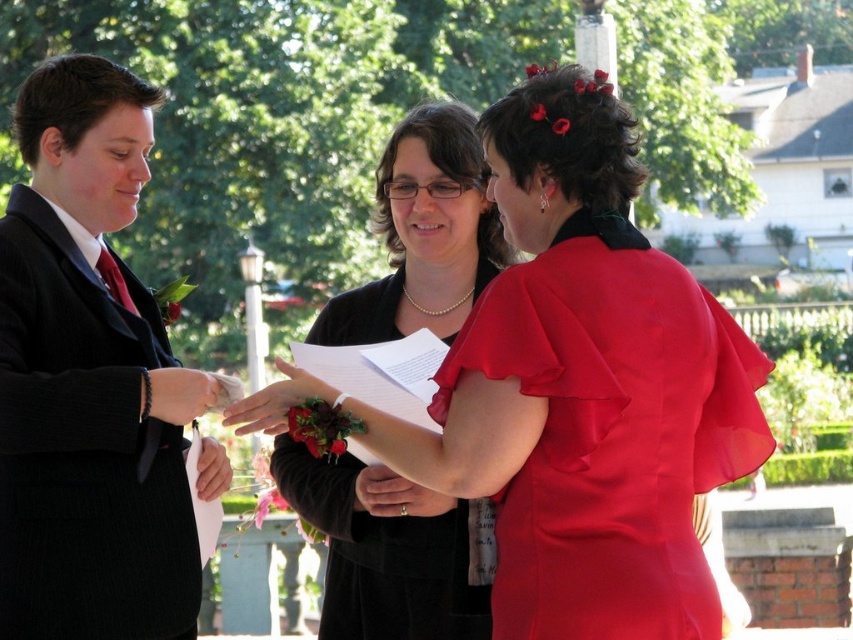
Question: Based on their relative distances, which object is nearer to the pearl necklace at center?

Choices:
 (A) matte black suit at left
 (B) satin red dress at center

Answer: (B)

Question: Observing the image, what is the correct spatial positioning of matte black suit at left in reference to pearl necklace at center?

Choices:
 (A) above
 (B) below

Answer: (A)

Question: Which point is closer to the camera?

Choices:
 (A) (357, 339)
 (B) (129, 144)
 (C) (642, 365)

Answer: (C)

Question: Can you confirm if satin red dress at center is wider than pearl necklace at center?

Choices:
 (A) no
 (B) yes

Answer: (B)

Question: Based on their relative distances, which object is farther from the matte black suit at left?

Choices:
 (A) satin red dress at center
 (B) pearl necklace at center

Answer: (A)

Question: Is matte black suit at left wider than satin red dress at center?

Choices:
 (A) no
 (B) yes

Answer: (A)